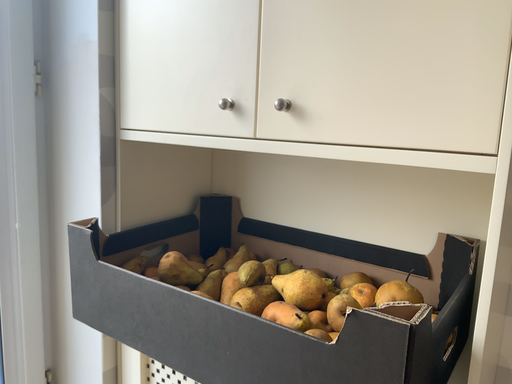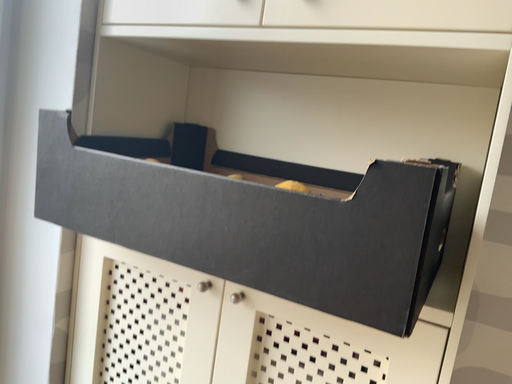
Question: Which way did the camera rotate in the video?

Choices:
 (A) rotated right
 (B) rotated left

Answer: (A)